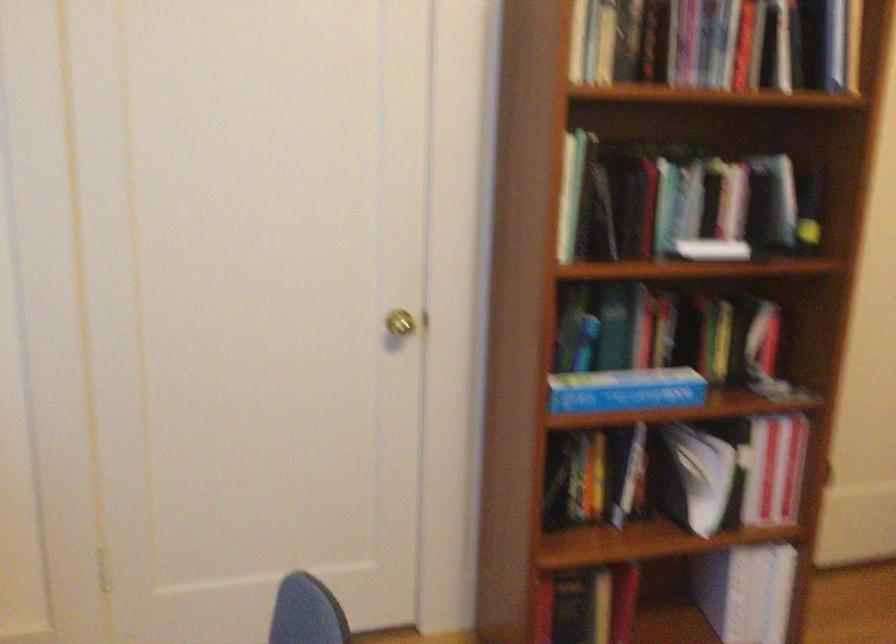
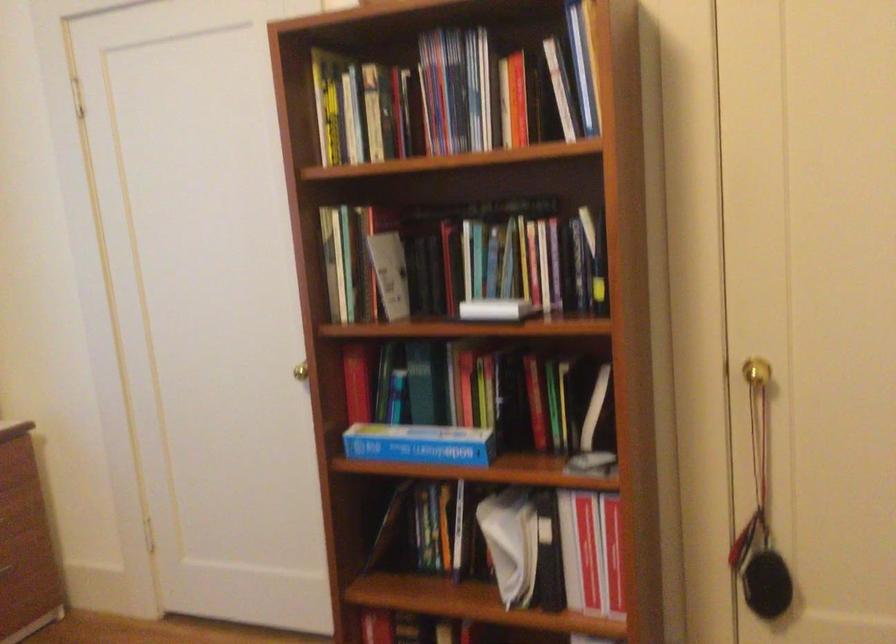
Locate, in the second image, the point that corresponds to (x=634, y=389) in the first image.

(419, 444)